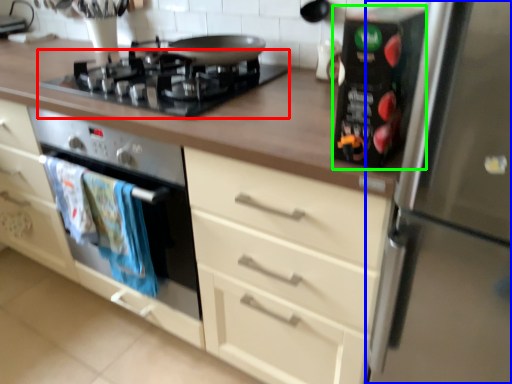
Question: Which is farther away from gas stove (highlighted by a red box)? refrigerator (highlighted by a blue box) or appliance (highlighted by a green box)?

Choices:
 (A) refrigerator
 (B) appliance

Answer: (A)